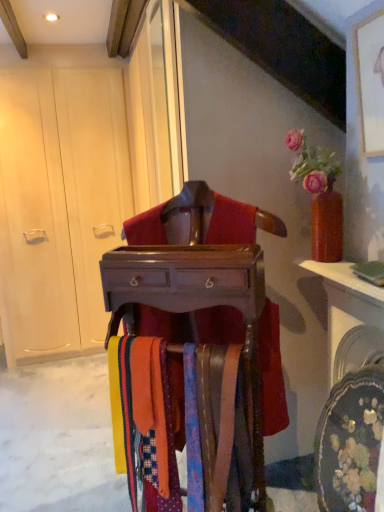
This screenshot has height=512, width=384. In order to click on free space in front of matte white armoire at left in this screenshot , I will do `click(55, 380)`.